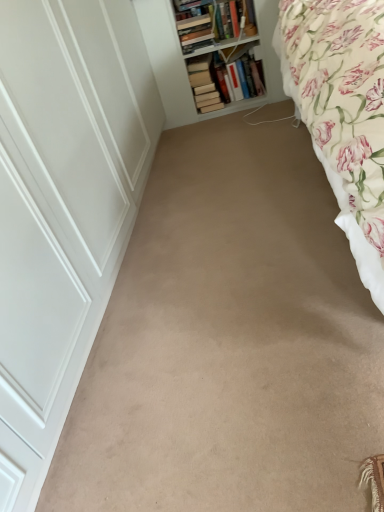
Question: Considering the positions of hardcover book at upper center, the third book in the right-to-left sequence, and beige carpet at center in the image, is hardcover book at upper center, the third book in the right-to-left sequence, wider or thinner than beige carpet at center?

Choices:
 (A) wide
 (B) thin

Answer: (B)

Question: In the image, is hardcover book at upper center, placed as the first book when sorted from left to right, on the left side or the right side of beige carpet at center?

Choices:
 (A) left
 (B) right

Answer: (A)

Question: Estimate the real-world distances between objects in this image. Which object is farther from the beige carpet at center?

Choices:
 (A) hardcover book at upper center, the third book in the right-to-left sequence
 (B) white wooden bookshelf at upper center
 (C) hardcover books at upper center, which is the second book from left to right
 (D) floral cotton bed at right
 (E) hardcover book at upper center, which appears as the first book when viewed from the right

Answer: (C)

Question: Which of these objects is positioned closest to the floral cotton bed at right?

Choices:
 (A) hardcover books at upper center, which is the 2th book from right to left
 (B) hardcover book at upper center, the 3th book in the left-to-right sequence
 (C) beige carpet at center
 (D) hardcover book at upper center, the third book in the right-to-left sequence
 (E) white wooden bookshelf at upper center

Answer: (C)